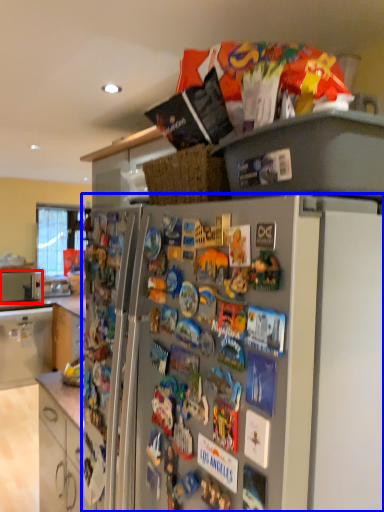
Question: Which point is closer to the camera, appliance (highlighted by a red box) or refrigerator (highlighted by a blue box)?

Choices:
 (A) appliance
 (B) refrigerator

Answer: (B)